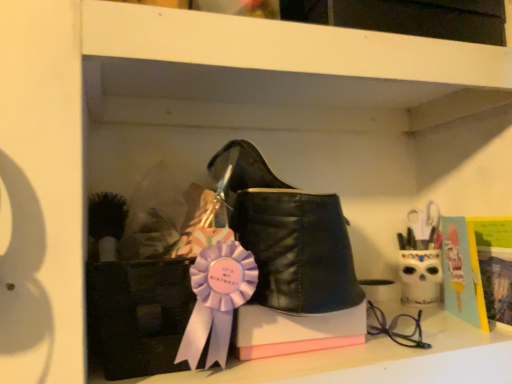
Question: Does matte black glasses at lower right come behind black leather boot at center?

Choices:
 (A) yes
 (B) no

Answer: (A)

Question: Considering the relative sizes of matte black glasses at lower right and black leather boot at center in the image provided, is matte black glasses at lower right thinner than black leather boot at center?

Choices:
 (A) no
 (B) yes

Answer: (B)

Question: Would you consider matte black glasses at lower right to be distant from black leather boot at center?

Choices:
 (A) yes
 (B) no

Answer: (B)

Question: Can you confirm if matte black glasses at lower right is wider than black leather boot at center?

Choices:
 (A) no
 (B) yes

Answer: (A)

Question: Can you confirm if matte black glasses at lower right is shorter than black leather boot at center?

Choices:
 (A) yes
 (B) no

Answer: (A)

Question: Relative to black leather boot at center, is matte black glasses at lower right in front or behind?

Choices:
 (A) front
 (B) behind

Answer: (B)

Question: Is matte black glasses at lower right bigger or smaller than black leather boot at center?

Choices:
 (A) small
 (B) big

Answer: (A)

Question: From the image's perspective, is matte black glasses at lower right located above or below black leather boot at center?

Choices:
 (A) above
 (B) below

Answer: (B)

Question: In terms of height, does matte black glasses at lower right look taller or shorter compared to black leather boot at center?

Choices:
 (A) short
 (B) tall

Answer: (A)

Question: Is point (105, 49) positioned closer to the camera than point (214, 177)?

Choices:
 (A) farther
 (B) closer

Answer: (B)

Question: In the image, is white matte shelf at upper center positioned in front of or behind black leather boot at center?

Choices:
 (A) behind
 (B) front

Answer: (B)

Question: Is white matte shelf at upper center wider or thinner than black leather boot at center?

Choices:
 (A) thin
 (B) wide

Answer: (B)

Question: Is white matte shelf at upper center to the left or to the right of black leather boot at center in the image?

Choices:
 (A) right
 (B) left

Answer: (A)

Question: From the image's perspective, is black leather boot at center located above or below matte black glasses at lower right?

Choices:
 (A) below
 (B) above

Answer: (B)

Question: Is black leather boot at center to the left or to the right of matte black glasses at lower right in the image?

Choices:
 (A) left
 (B) right

Answer: (A)